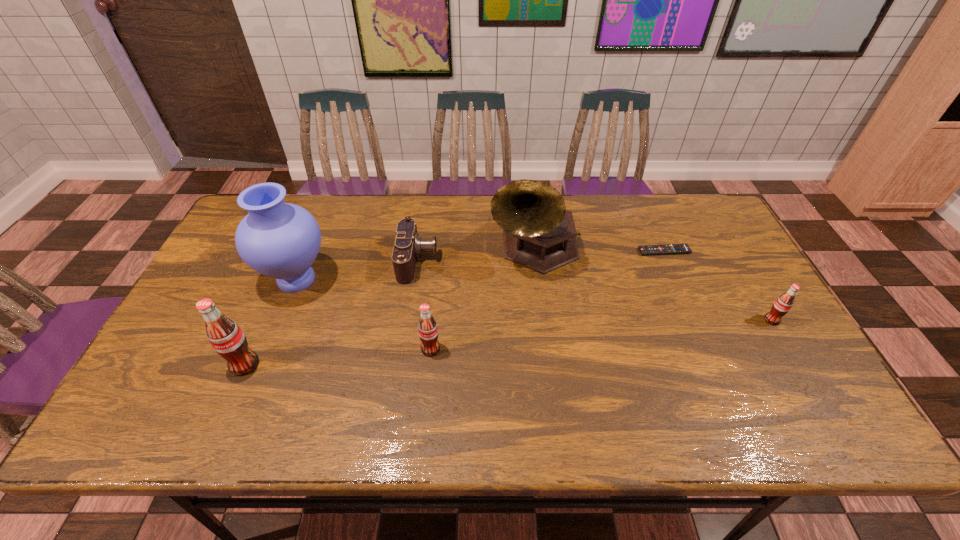
If equal spacing is the goal by inserting an additional pop_(soda) among them, please point out a vacant space for this new pop_(soda). Please provide its 2D coordinates. Your answer should be formatted as a tuple, i.e. [(x, y)], where the tuple contains the x and y coordinates of a point satisfying the conditions above.

[(606, 334)]